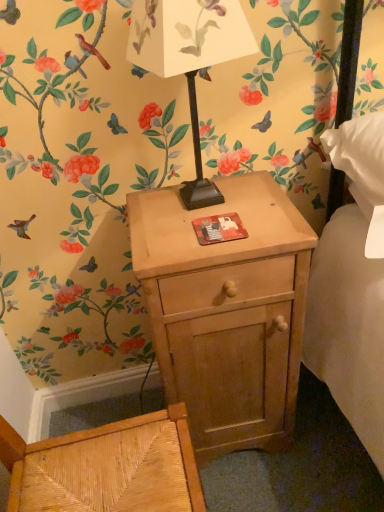
You are a GUI agent. You are given a task and a screenshot of the screen. Output one action in this format:
    pyautogui.click(x=<x>, y=<y>)
    Task: Click on the free space underneath matte black table lamp at center (from a real-world perspective)
    
    Given the screenshot: What is the action you would take?
    pyautogui.click(x=196, y=212)